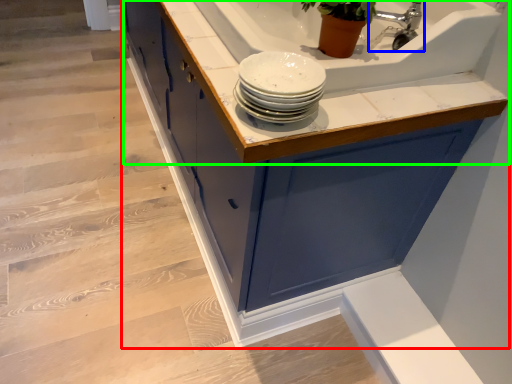
Question: Which is farther away from cabinetry (highlighted by a red box)? tap (highlighted by a blue box) or countertop (highlighted by a green box)?

Choices:
 (A) tap
 (B) countertop

Answer: (A)